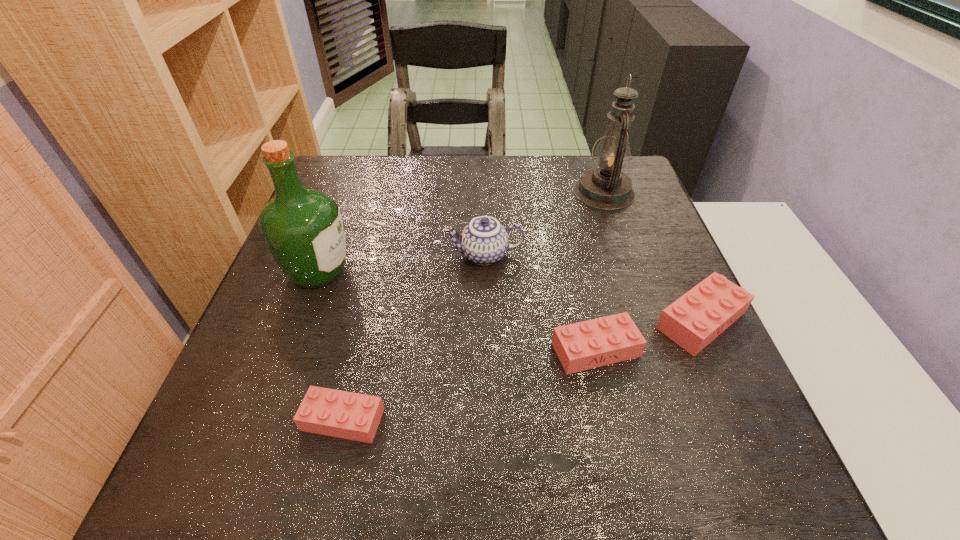
This screenshot has width=960, height=540. What are the coordinates of `free space between the rightmost Lego and the second shortest Lego` in the screenshot? It's located at (648, 335).

Where is `unoccupied area between the liquor and the third object from left to right`? unoccupied area between the liquor and the third object from left to right is located at coordinates (401, 264).

Point out which object is positioned as the nearest to the oil lamp. Please provide its 2D coordinates. Your answer should be formatted as a tuple, i.e. [(x, y)], where the tuple contains the x and y coordinates of a point satisfying the conditions above.

[(484, 241)]

Identify which object is located as the third nearest to the rightmost Lego. Please provide its 2D coordinates. Your answer should be formatted as a tuple, i.e. [(x, y)], where the tuple contains the x and y coordinates of a point satisfying the conditions above.

[(606, 187)]

Identify the location of Lego that stands as the closest to the farthest object. (694, 320).

The image size is (960, 540). Identify the location of the closest Lego to the shortest Lego. (598, 342).

You are a GUI agent. You are given a task and a screenshot of the screen. Output one action in this format:
    pyautogui.click(x=<x>, y=<y>)
    Task: Click on the vacant point that satisfies the following two spatial constraints: 1. on the front side of the farthest object; 2. from the spout of the chinaware
    
    Given the screenshot: What is the action you would take?
    pyautogui.click(x=625, y=255)

The width and height of the screenshot is (960, 540). I want to click on vacant point that satisfies the following two spatial constraints: 1. on the front side of the oil lamp; 2. on the right side of the rightmost Lego, so click(x=648, y=321).

Locate an element on the screen. The width and height of the screenshot is (960, 540). vacant space that satisfies the following two spatial constraints: 1. from the spout of the chinaware; 2. on the left side of the rightmost Lego is located at coordinates (486, 321).

Locate an element on the screen. Image resolution: width=960 pixels, height=540 pixels. vacant region that satisfies the following two spatial constraints: 1. from the spout of the chinaware; 2. on the back side of the rightmost Lego is located at coordinates 486,321.